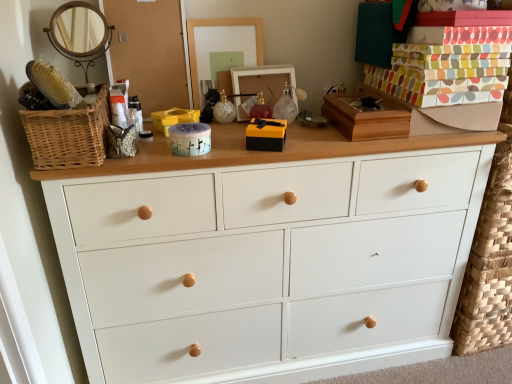
Question: Would you say woven wood basket at left is outside matte glass ornament at center?

Choices:
 (A) yes
 (B) no

Answer: (A)

Question: From a real-world perspective, is woven wood basket at left physically above matte glass ornament at center?

Choices:
 (A) no
 (B) yes

Answer: (B)

Question: Considering the relative sizes of woven wood basket at left and matte glass ornament at center in the image provided, is woven wood basket at left taller than matte glass ornament at center?

Choices:
 (A) yes
 (B) no

Answer: (A)

Question: From the image's perspective, is woven wood basket at left beneath matte glass ornament at center?

Choices:
 (A) yes
 (B) no

Answer: (A)

Question: Considering the relative sizes of woven wood basket at left and matte glass ornament at center in the image provided, is woven wood basket at left smaller than matte glass ornament at center?

Choices:
 (A) yes
 (B) no

Answer: (B)

Question: Is woven wood basket at left in front of matte glass ornament at center?

Choices:
 (A) yes
 (B) no

Answer: (A)

Question: Is matte glass ornament at center with yellow plastic storage box at center?

Choices:
 (A) yes
 (B) no

Answer: (B)

Question: Is matte glass ornament at center far away from yellow plastic storage box at center?

Choices:
 (A) no
 (B) yes

Answer: (A)

Question: From a real-world perspective, is matte glass ornament at center beneath yellow plastic storage box at center?

Choices:
 (A) no
 (B) yes

Answer: (A)

Question: Is matte glass ornament at center to the left of yellow plastic storage box at center from the viewer's perspective?

Choices:
 (A) yes
 (B) no

Answer: (B)

Question: Is matte glass ornament at center outside yellow plastic storage box at center?

Choices:
 (A) no
 (B) yes

Answer: (B)

Question: Does matte glass ornament at center turn towards yellow plastic storage box at center?

Choices:
 (A) yes
 (B) no

Answer: (B)

Question: Can you confirm if yellow plastic storage box at center is positioned to the left of white painted wood chest of drawers at center?

Choices:
 (A) no
 (B) yes

Answer: (B)